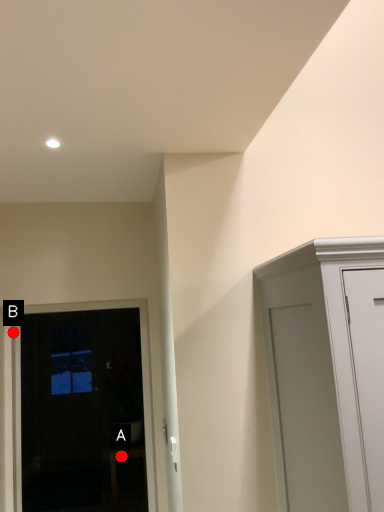
Question: Two points are circled on the image, labeled by A and B beside each circle. Which point appears closest to the camera in this image?

Choices:
 (A) A is closer
 (B) B is closer

Answer: (B)